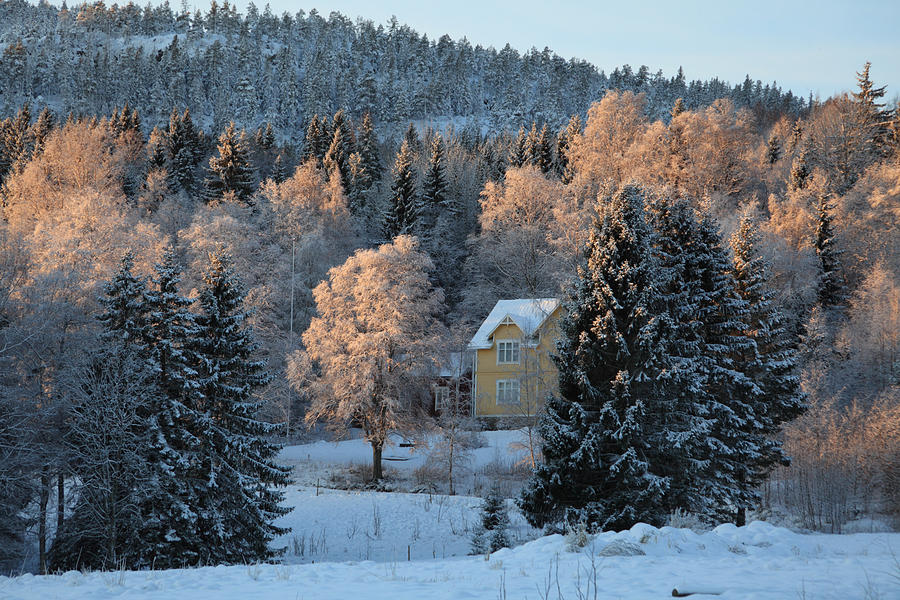
Find the location of a particular element. homes is located at coordinates (475, 350), (549, 335), (545, 370), (434, 403).